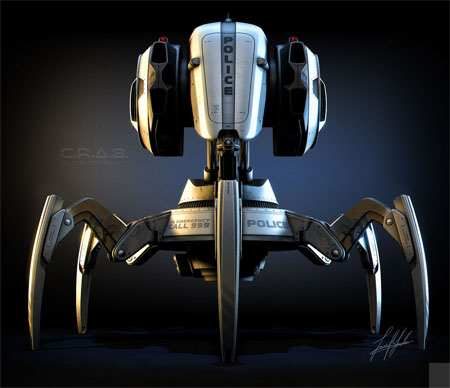
The height and width of the screenshot is (388, 450). What are the coordinates of `speakers` in the screenshot? It's located at [315, 91], [134, 112].